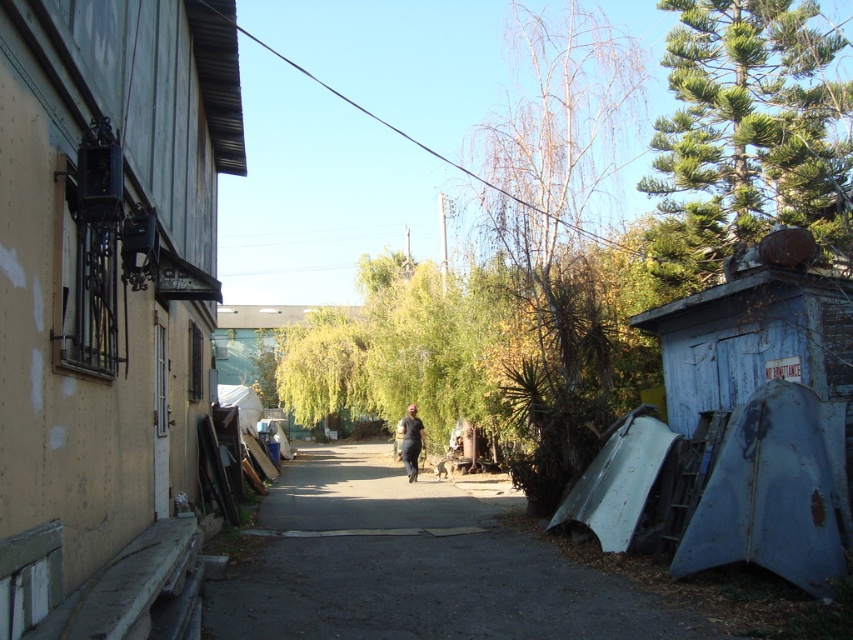
Is smooth concrete alley at center positioned at the back of green textured pine tree at upper right?

No, it is in front of green textured pine tree at upper right.

Is smooth concrete alley at center to the left of green textured pine tree at upper right from the viewer's perspective?

Yes, smooth concrete alley at center is to the left of green textured pine tree at upper right.

Between point (543, 580) and point (662, 157), which one is positioned behind?

The point (662, 157) is behind.

Image resolution: width=853 pixels, height=640 pixels. What are the coordinates of `smooth concrete alley at center` in the screenshot? It's located at (415, 566).

This screenshot has width=853, height=640. I want to click on bare branches at center, so click(x=556, y=241).

Looking at this image, is bare branches at center above green textured pine tree at upper right?

Correct, bare branches at center is located above green textured pine tree at upper right.

Who is more distant from viewer, (585, 284) or (697, 240)?

Positioned behind is point (697, 240).

At what (x,y) coordinates should I click in order to perform the action: click on bare branches at center. Please return your answer as a coordinate pair (x, y). Looking at the image, I should click on (556, 241).

Is smooth concrete alley at center wider than bare branches at center?

Incorrect, smooth concrete alley at center's width does not surpass bare branches at center's.

Which of these two, smooth concrete alley at center or bare branches at center, stands taller?

With more height is bare branches at center.

In order to click on smooth concrete alley at center in this screenshot , I will do `click(415, 566)`.